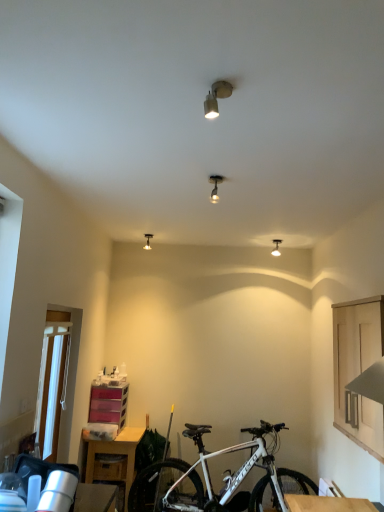
Question: From the image's perspective, is wooden table at lower left, positioned as the second table in front-to-back order, above or below matte silver spotlight at upper center, positioned as the fourth light fixture in bottom-to-top order?

Choices:
 (A) below
 (B) above

Answer: (A)

Question: Choose the correct answer: Is wooden table at lower left, which is the first table from bottom to top, inside matte silver spotlight at upper center, positioned as the fourth light fixture in bottom-to-top order, or outside it?

Choices:
 (A) outside
 (B) inside

Answer: (A)

Question: Which of these objects is positioned farthest from the matte silver spotlight at upper center, marked as the first light fixture in a top-to-bottom arrangement?

Choices:
 (A) metallic silver light fixture at upper center, the fourth light fixture viewed from the left
 (B) wooden table at lower right, the first table when ordered from right to left
 (C) white matte bicycle at lower center
 (D) matte silver light fixture at upper center, positioned as the 4th light fixture in right-to-left order
 (E) metallic track light at center, which is the second light fixture from right to left

Answer: (C)

Question: Estimate the real-world distances between objects in this image. Which object is closer to the metallic silver light fixture at upper center, the first light fixture when ordered from bottom to top?

Choices:
 (A) metallic track light at center, the 2th light fixture positioned from the top
 (B) matte silver spotlight at upper center, positioned as the second light fixture in left-to-right order
 (C) white matte bicycle at lower center
 (D) wooden table at lower right, the first table from the top
 (E) matte silver light fixture at upper center, which appears as the second light fixture when ordered from the bottom

Answer: (E)